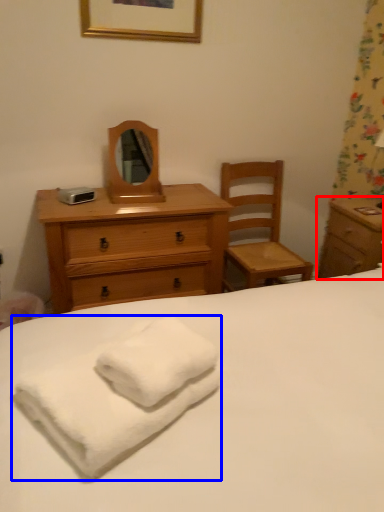
Question: Which point is further to the camera, nightstand (highlighted by a red box) or bath towel (highlighted by a blue box)?

Choices:
 (A) nightstand
 (B) bath towel

Answer: (A)